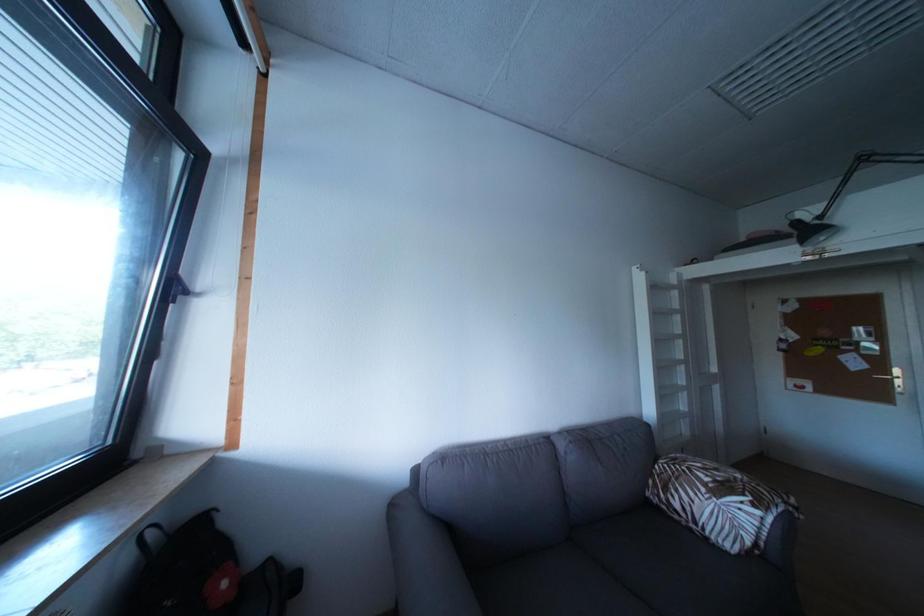
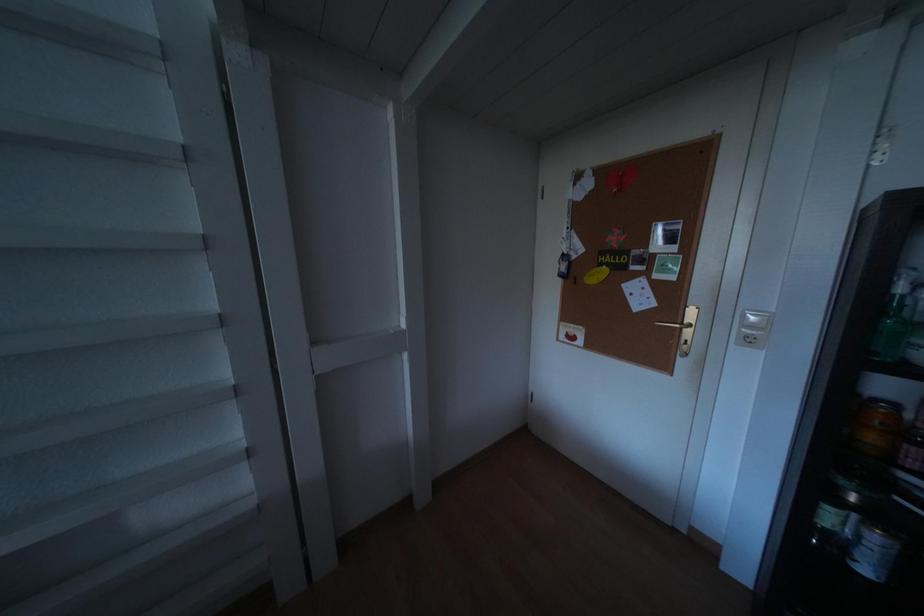
Based on the photo, the images are taken continuously from a first-person perspective. In which direction are you moving?

The cameraman moved toward right, forward.